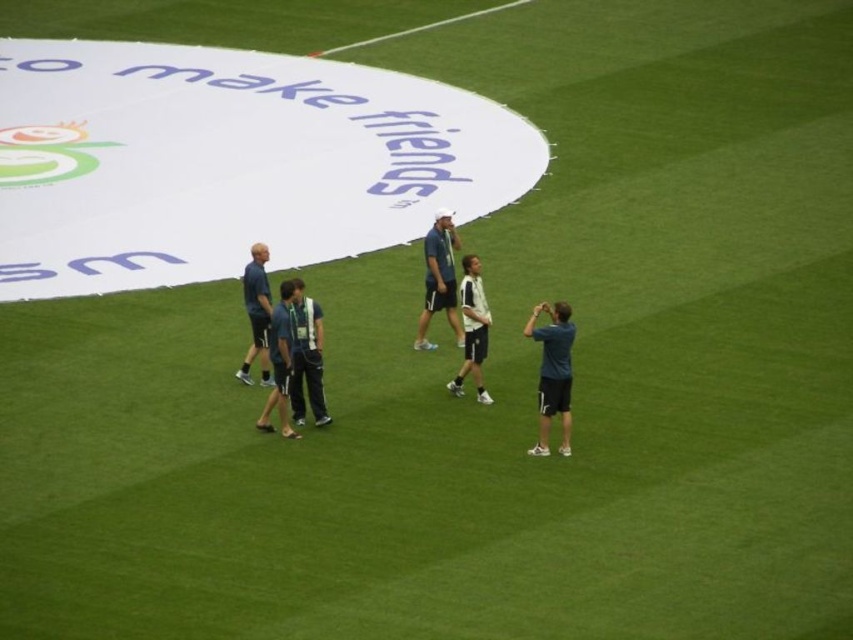
You are a photographer trying to capture a candid shot of the dark blue fabric shirt at center without including the dark blue jersey at center in the frame. Is this possible given their positions?

The dark blue fabric shirt at center is positioned under the dark blue jersey at center, so it might be challenging to capture the shirt without the jersey overlapping in the frame.

In the scene shown: You are standing on the grassy field and see the dark blue fabric at center and the white matte jacket at center. Which object is positioned to the left?

The dark blue fabric at center is to the left of the white matte jacket at center.